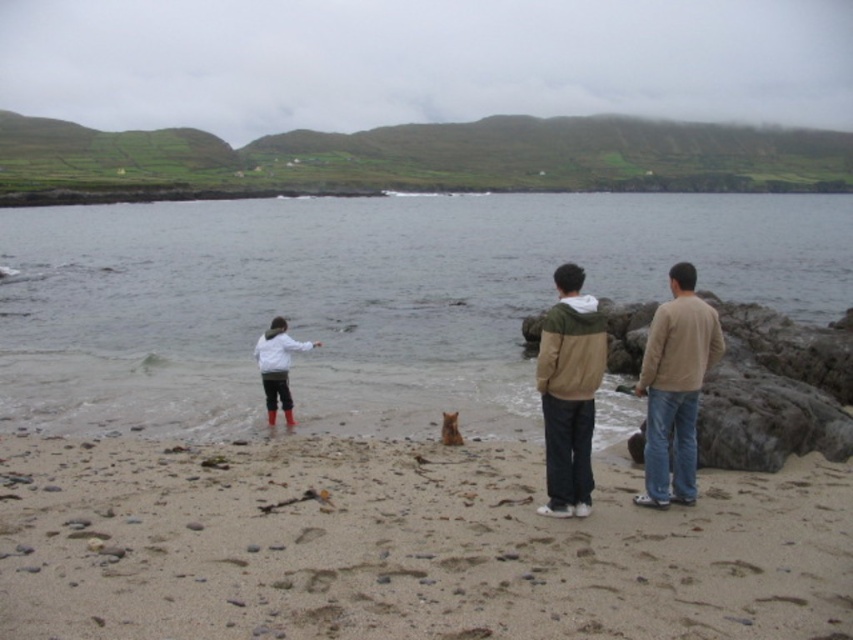
Measure the distance between beige sweater at right and beige fleece jacket at center.

beige sweater at right and beige fleece jacket at center are 4.62 feet apart from each other.

Who is higher up, beige sweater at right or beige fleece jacket at center?

beige sweater at right is higher up.

Which is behind, point (680, 314) or point (544, 378)?

Point (680, 314)

The image size is (853, 640). Identify the location of beige sweater at right. (675, 387).

Describe the element at coordinates (363, 298) in the screenshot. This screenshot has height=640, width=853. I see `clear water at center` at that location.

Can you confirm if clear water at center is bigger than brown fur dog at center?

Correct, clear water at center is larger in size than brown fur dog at center.

Measure the distance between point (x=512, y=209) and camera.

A distance of 267.90 feet exists between point (x=512, y=209) and camera.

Locate an element on the screen. Image resolution: width=853 pixels, height=640 pixels. clear water at center is located at coordinates (363, 298).

In the scene shown: Does beige sweater at right have a greater width compared to white matte jacket at lower left?

No, beige sweater at right is not wider than white matte jacket at lower left.

Which is in front, point (660, 346) or point (308, 344)?

Point (660, 346) is more forward.

Does point (657, 472) come farther from viewer compared to point (271, 346)?

No, it is in front of (271, 346).

You are a GUI agent. You are given a task and a screenshot of the screen. Output one action in this format:
    pyautogui.click(x=<x>, y=<y>)
    Task: Click on the beige sweater at right
    The image size is (853, 640).
    Given the screenshot: What is the action you would take?
    pyautogui.click(x=675, y=387)